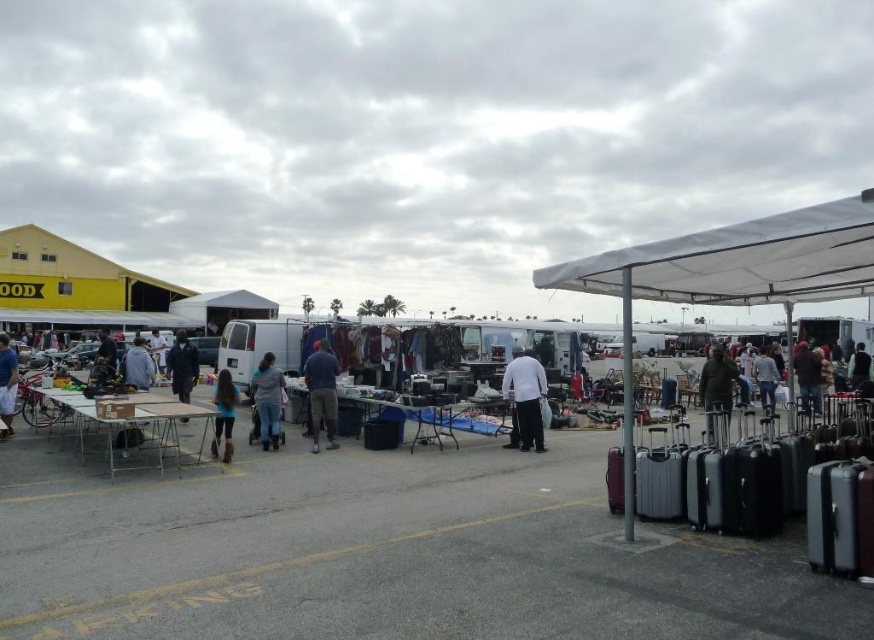
Question: Can you confirm if denim pants at center is positioned to the right of dark blue jeans at center?

Choices:
 (A) yes
 (B) no

Answer: (A)

Question: Estimate the real-world distances between objects in this image. Which object is farther from the metallic gray suitcase at lower right?

Choices:
 (A) dark green fabric jacket at center
 (B) white fabric canopy at upper right
 (C) dark blue jeans at lower right

Answer: (C)

Question: Which object is positioned closest to the dark blue jeans at lower right?

Choices:
 (A) blue denim jeans at left
 (B) white matte shirt at center
 (C) jeans at center

Answer: (C)

Question: Which object is farther from the camera taking this photo?

Choices:
 (A) blue denim jeans at left
 (B) dark blue fabric coat at center

Answer: (A)

Question: Is white fabric canopy at upper right above dark blue jeans at center?

Choices:
 (A) yes
 (B) no

Answer: (A)

Question: Where is dark green fabric jacket at center located in relation to dark blue jeans at center in the image?

Choices:
 (A) below
 (B) above

Answer: (A)